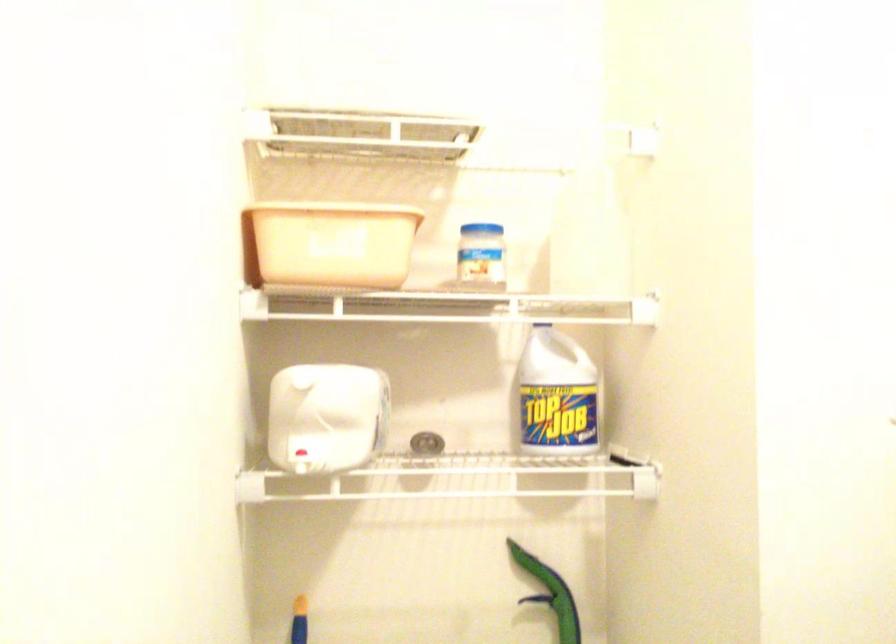
This screenshot has width=896, height=644. I want to click on white bottle cap, so click(644, 483).